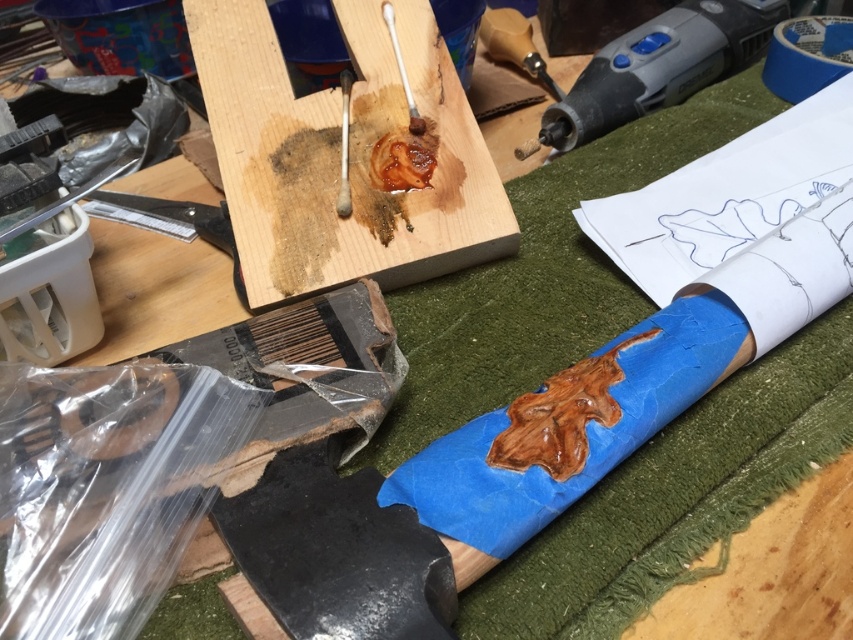
Is wooden plank at center taller than wooden stick at upper center?

Indeed, wooden plank at center has a greater height compared to wooden stick at upper center.

Describe the element at coordinates (338, 154) in the screenshot. I see `wooden plank at center` at that location.

At what (x,y) coordinates should I click in order to perform the action: click on wooden plank at center. Please return your answer as a coordinate pair (x, y). Looking at the image, I should click on (338, 154).

Does point (212, 58) come in front of point (759, 54)?

Yes, it is in front of point (759, 54).

Can you confirm if wooden plank at center is positioned to the left of matte gray power tool at upper right?

Indeed, wooden plank at center is positioned on the left side of matte gray power tool at upper right.

Who is more distant from viewer, (450, 195) or (606, 83)?

Point (606, 83)

Identify the location of wooden plank at center. This screenshot has width=853, height=640. (338, 154).

Based on the photo, between matte gray power tool at upper right and wooden stick at upper center, which one has more height?

Standing taller between the two is matte gray power tool at upper right.

Which is more to the left, matte gray power tool at upper right or wooden stick at upper center?

wooden stick at upper center is more to the left.

Which is behind, point (705, 58) or point (349, 77)?

The point (705, 58) is more distant.

I want to click on matte gray power tool at upper right, so click(x=657, y=67).